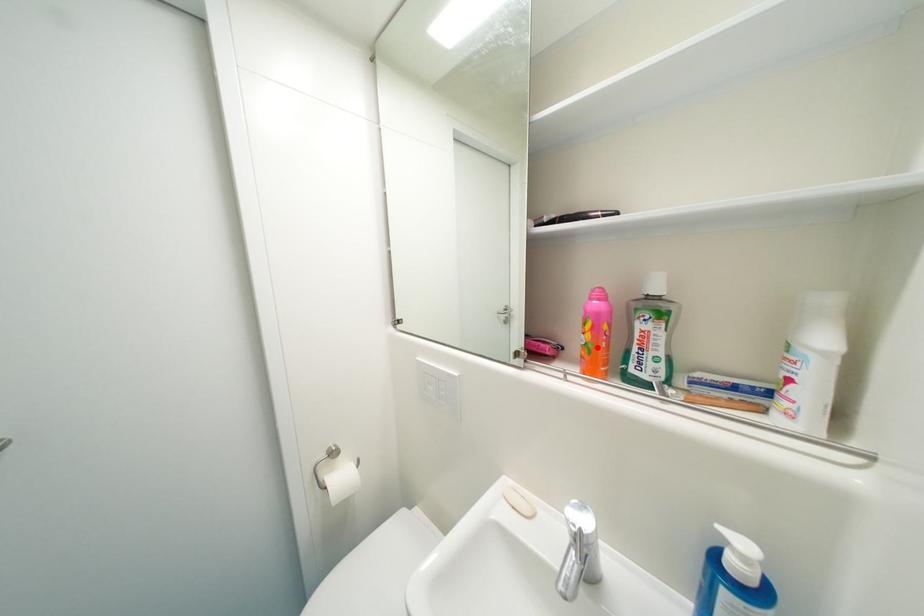
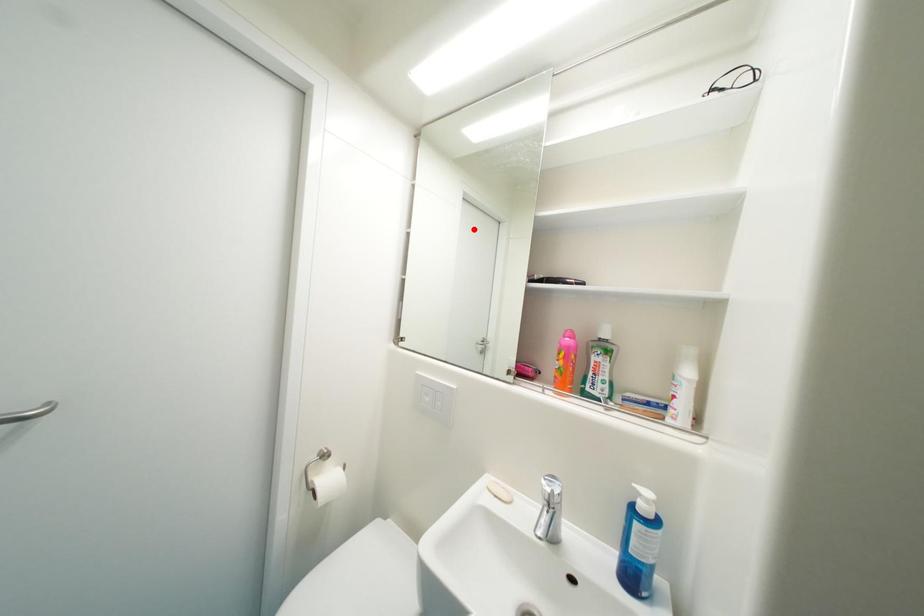
I am providing you with two images of the same scene from different viewpoints. A red point is marked on the first image and another point is marked on the second image. Is the marked point in image1 the same physical position as the marked point in image2?

No